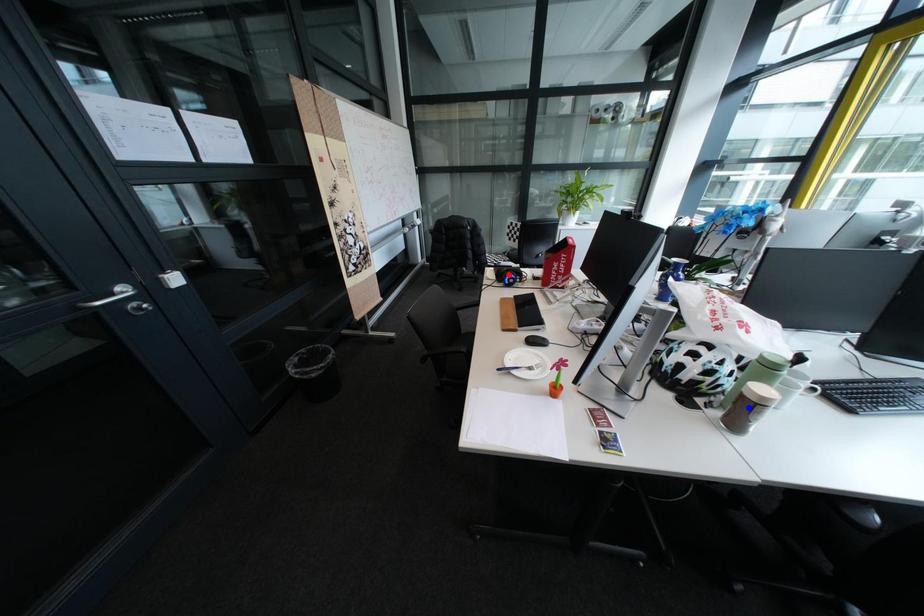
Question: Two points are marked on the image. Which point is closer to the camera?

Choices:
 (A) Blue point is closer.
 (B) Red point is closer.

Answer: (A)